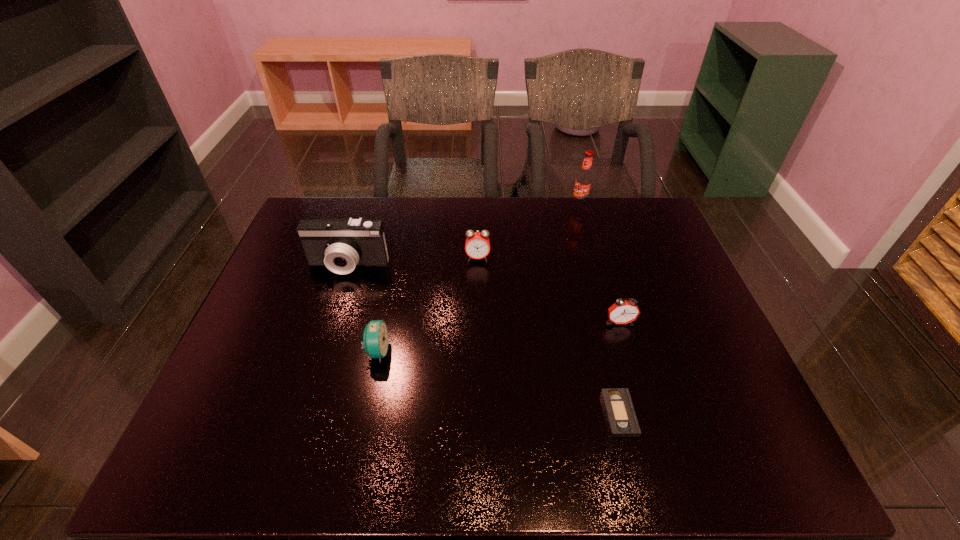
Find the location of a particular element. Image resolution: width=960 pixels, height=540 pixels. free space between the fifth shortest object and the tallest object is located at coordinates (464, 235).

I want to click on vacant region between the camcorder and the leftmost alarm clock, so click(x=363, y=308).

At what (x,y) coordinates should I click in order to perform the action: click on vacant space that is in between the rightmost alarm clock and the shortest object. Please return your answer as a coordinate pair (x, y). This screenshot has height=540, width=960. Looking at the image, I should click on (619, 368).

You are a GUI agent. You are given a task and a screenshot of the screen. Output one action in this format:
    pyautogui.click(x=<x>, y=<y>)
    Task: Click on the free space between the tallest object and the videotape
    This screenshot has width=960, height=540.
    Given the screenshot: What is the action you would take?
    pyautogui.click(x=599, y=309)

Image resolution: width=960 pixels, height=540 pixels. What are the coordinates of `object that stands as the fifth closest to the tallest object` in the screenshot? It's located at (375, 342).

Find the location of a particular element. The image size is (960, 540). the fourth closest object relative to the rightmost alarm clock is located at coordinates (375, 342).

Identify the location of the closest alarm clock relative to the farthest object. This screenshot has width=960, height=540. (477, 246).

Where is `alarm clock that can be found as the closest to the leftmost alarm clock`? The height and width of the screenshot is (540, 960). alarm clock that can be found as the closest to the leftmost alarm clock is located at coordinates click(x=477, y=246).

Where is `vacant space that satisfies the following two spatial constraints: 1. on the clock face of the third nearest object; 2. on the front-facing side of the second nearest object`? vacant space that satisfies the following two spatial constraints: 1. on the clock face of the third nearest object; 2. on the front-facing side of the second nearest object is located at coordinates (628, 351).

I want to click on vacant area that satisfies the following two spatial constraints: 1. on the front-facing side of the second alarm clock from left to right; 2. on the left side of the shortest object, so click(x=477, y=414).